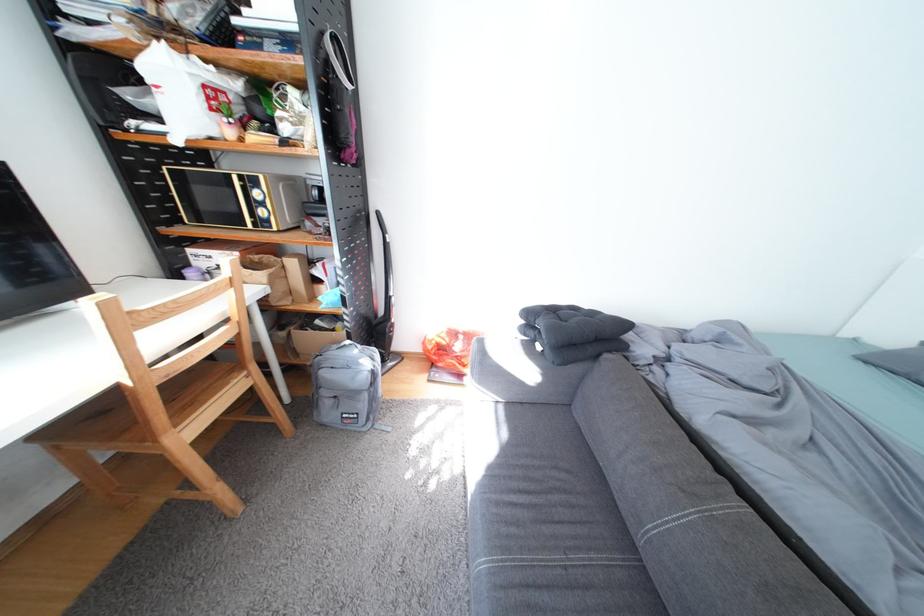
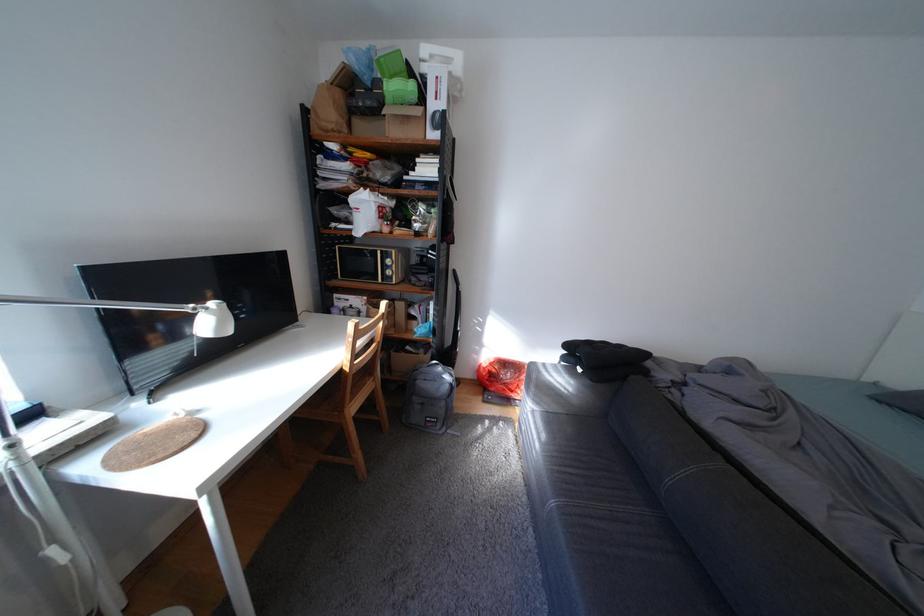
The point at [779,390] is marked in the first image. Where is the corresponding point in the second image?

(773, 407)